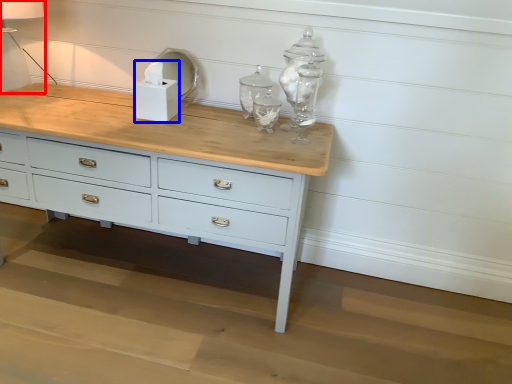
Question: Among these objects, which one is farthest to the camera, table lamp (highlighted by a red box) or candle holder (highlighted by a blue box)?

Choices:
 (A) table lamp
 (B) candle holder

Answer: (B)